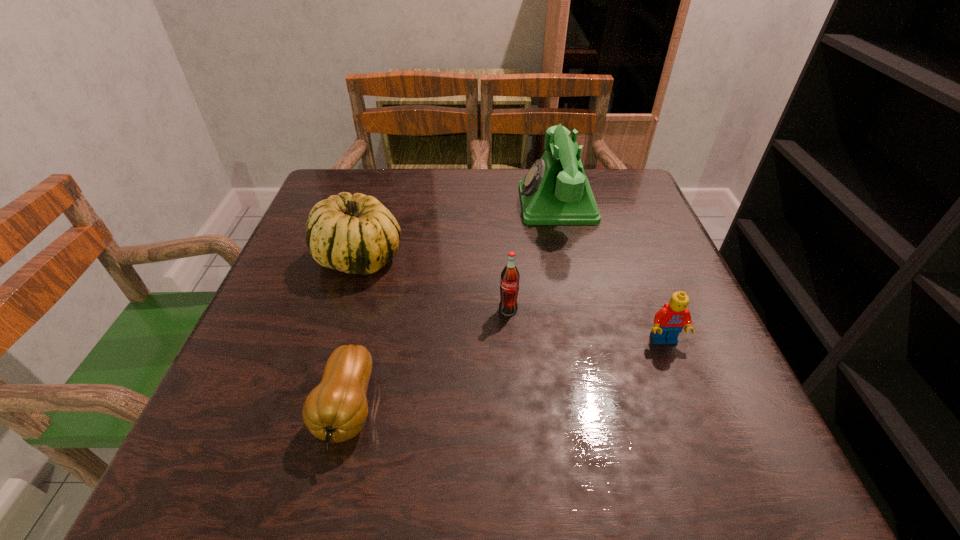
This screenshot has width=960, height=540. In order to click on object at the far right corner in this screenshot , I will do `click(555, 191)`.

The width and height of the screenshot is (960, 540). I want to click on vacant area at the far edge, so click(x=454, y=186).

The height and width of the screenshot is (540, 960). In the image, there is a desktop. Find the location of `vacant region at the near edge`. vacant region at the near edge is located at coordinates (568, 452).

This screenshot has width=960, height=540. I want to click on vacant space at the left edge of the desktop, so pos(313,281).

You are a GUI agent. You are given a task and a screenshot of the screen. Output one action in this format:
    pyautogui.click(x=<x>, y=<y>)
    Task: Click on the free space at the right edge of the desktop
    The image size is (960, 540).
    Given the screenshot: What is the action you would take?
    pyautogui.click(x=664, y=346)

Identify the location of vacant space at the far right corner. The width and height of the screenshot is (960, 540). (620, 188).

This screenshot has height=540, width=960. I want to click on unoccupied position between the fourth object from left to right and the third object from right to left, so click(x=533, y=256).

At what (x,y) coordinates should I click in order to perform the action: click on free space between the third nearest object and the fourth farthest object. Please return your answer as a coordinate pair (x, y). This screenshot has height=540, width=960. Looking at the image, I should click on (587, 325).

You are a GUI agent. You are given a task and a screenshot of the screen. Output one action in this format:
    pyautogui.click(x=<x>, y=<y>)
    Task: Click on the vacant region between the shorter gourd and the second object from right to left
    This screenshot has height=540, width=960.
    Given the screenshot: What is the action you would take?
    pyautogui.click(x=452, y=306)

This screenshot has width=960, height=540. I want to click on free area in between the third farthest object and the telephone, so click(x=533, y=256).